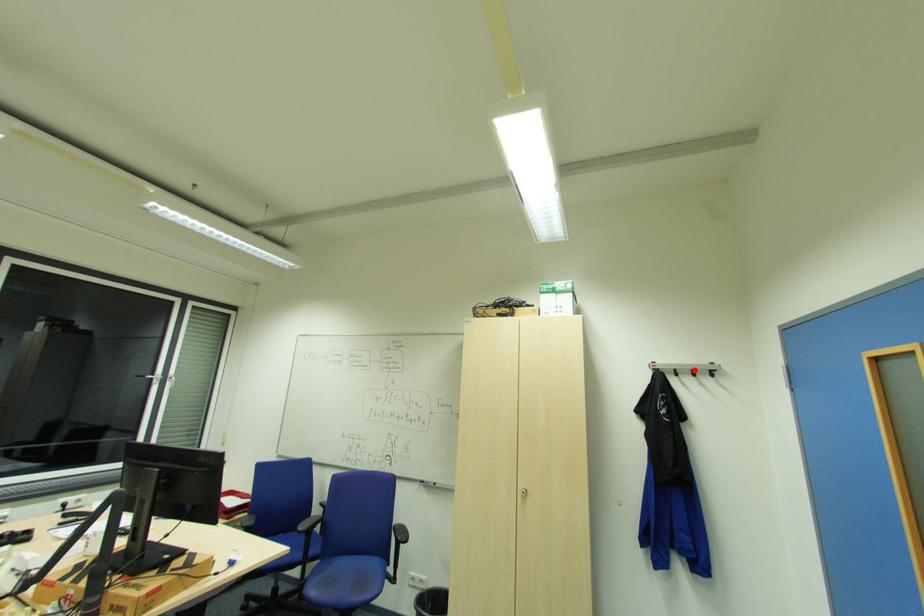
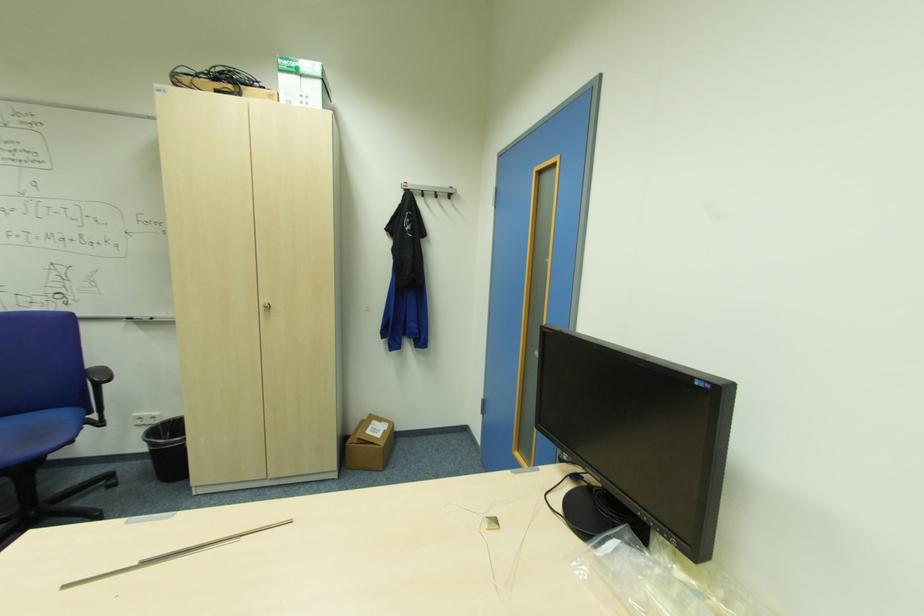
Locate, in the second image, the point that corresponds to the highlighted location in the first image.

(439, 192)